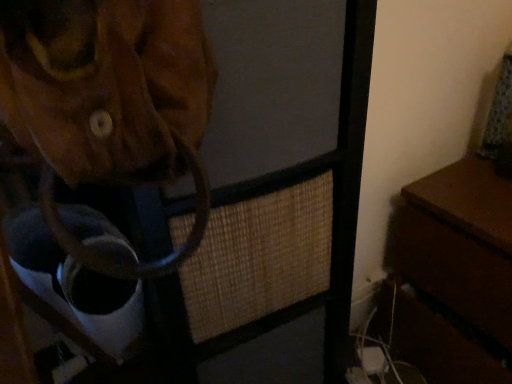
Question: From a real-world perspective, is brown leather bag at upper left physically located above or below brown wooden table at right?

Choices:
 (A) below
 (B) above

Answer: (B)

Question: Is brown leather bag at upper left bigger or smaller than brown wooden table at right?

Choices:
 (A) small
 (B) big

Answer: (B)

Question: Is point (156, 218) positioned closer to the camera than point (496, 241)?

Choices:
 (A) farther
 (B) closer

Answer: (B)

Question: From the image's perspective, is brown wooden table at right positioned above or below brown leather bag at upper left?

Choices:
 (A) above
 (B) below

Answer: (B)

Question: Relative to brown leather bag at upper left, is brown wooden table at right in front or behind?

Choices:
 (A) behind
 (B) front

Answer: (A)

Question: From their relative heights in the image, would you say brown wooden table at right is taller or shorter than brown leather bag at upper left?

Choices:
 (A) tall
 (B) short

Answer: (B)

Question: From a real-world perspective, is brown wooden table at right positioned above or below brown leather bag at upper left?

Choices:
 (A) above
 (B) below

Answer: (B)